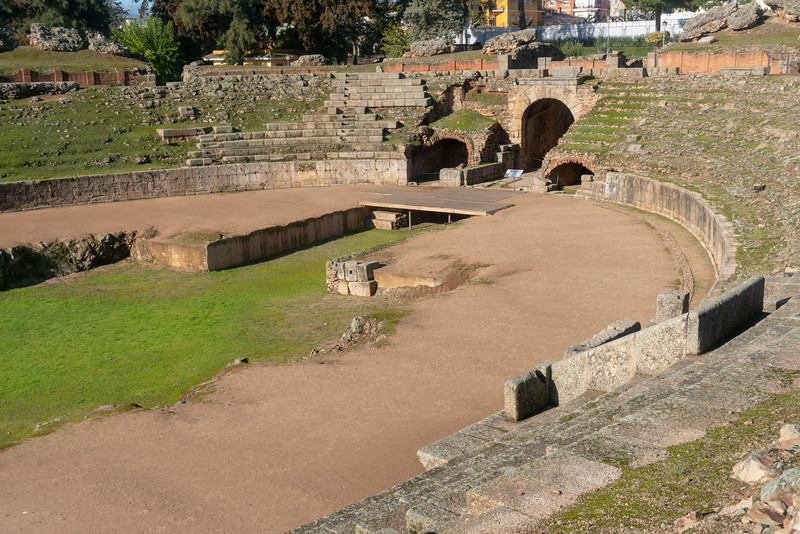
Where is `support poles in the center`? The width and height of the screenshot is (800, 534). support poles in the center is located at coordinates (408, 219), (448, 218).